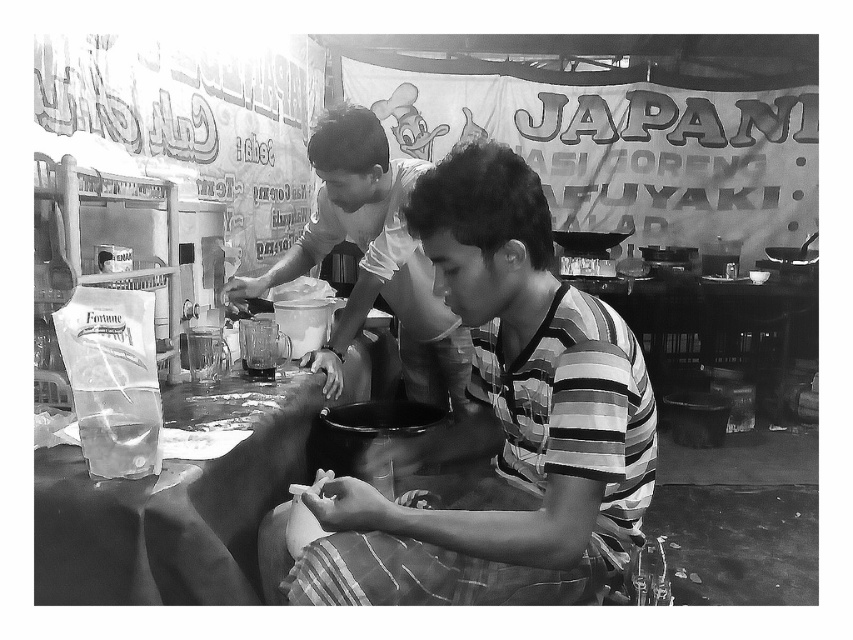
In the bustling food preparation scene, there are two people at the center wearing striped fabric shirt at center and smooth white shirt at center. From the perspective of someone facing the scene, which shirt is positioned to the right?

The striped fabric shirt at center is to the right of the smooth white shirt at center.

You are a customer at this street food stall and want to order from the person closest to you. Which person should you approach, the striped fabric shirt at center or the smooth white shirt at center?

The striped fabric shirt at center is closer to the viewer than the smooth white shirt at center, so you should approach the striped fabric shirt at center.